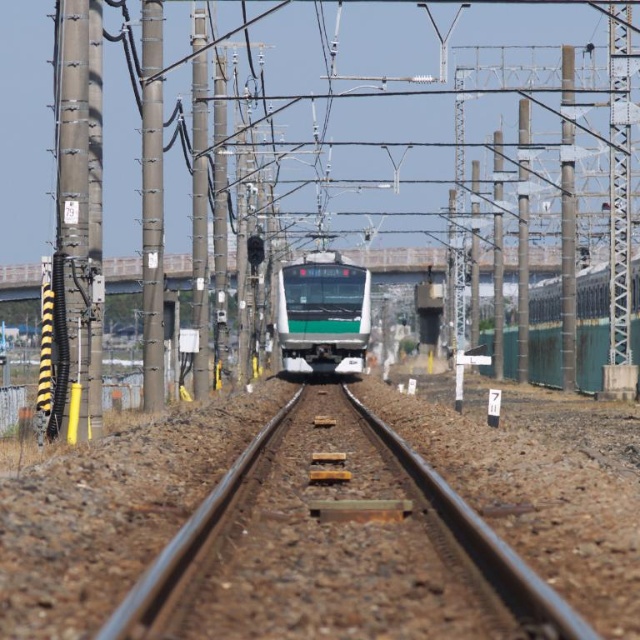
Question: Which point is closer to the camera taking this photo?

Choices:
 (A) (314, 403)
 (B) (298, 300)

Answer: (A)

Question: Which object is farther from the camera taking this photo?

Choices:
 (A) green matte train at center
 (B) smooth metal train track at center

Answer: (A)

Question: From the image, what is the correct spatial relationship of smooth metal train track at center in relation to green matte train at center?

Choices:
 (A) left
 (B) right

Answer: (B)

Question: Can you confirm if smooth metal train track at center is positioned to the right of green matte train at center?

Choices:
 (A) yes
 (B) no

Answer: (A)

Question: Does smooth metal train track at center have a greater width compared to green matte train at center?

Choices:
 (A) yes
 (B) no

Answer: (A)

Question: Which point is closer to the camera taking this photo?

Choices:
 (A) (285, 454)
 (B) (328, 346)

Answer: (A)